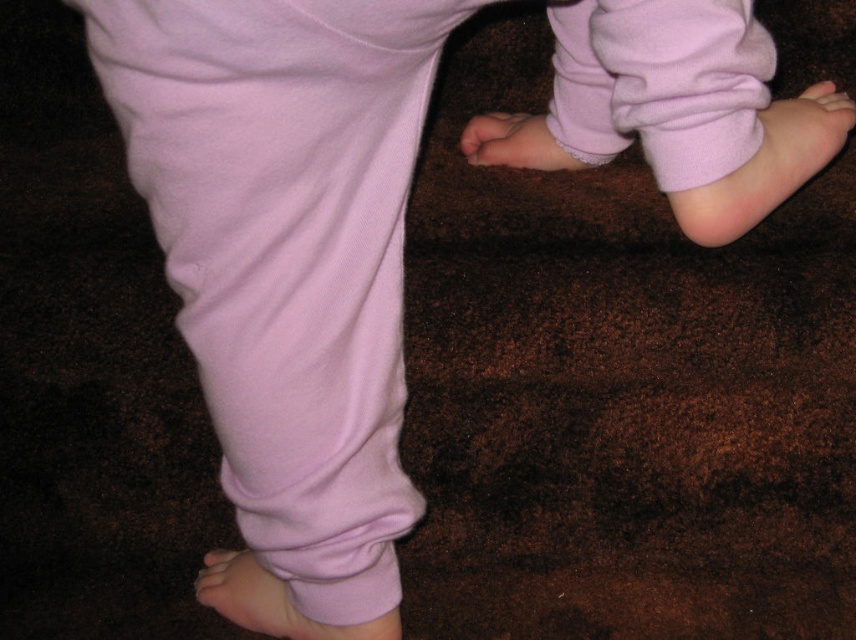
You are a tailor trying to adjust the length of the pink soft fabric foot at center and the pink soft skin at lower right. Which one is closer to the ground?

The pink soft fabric foot at center is positioned under the pink soft skin at lower right, so it is closer to the ground.